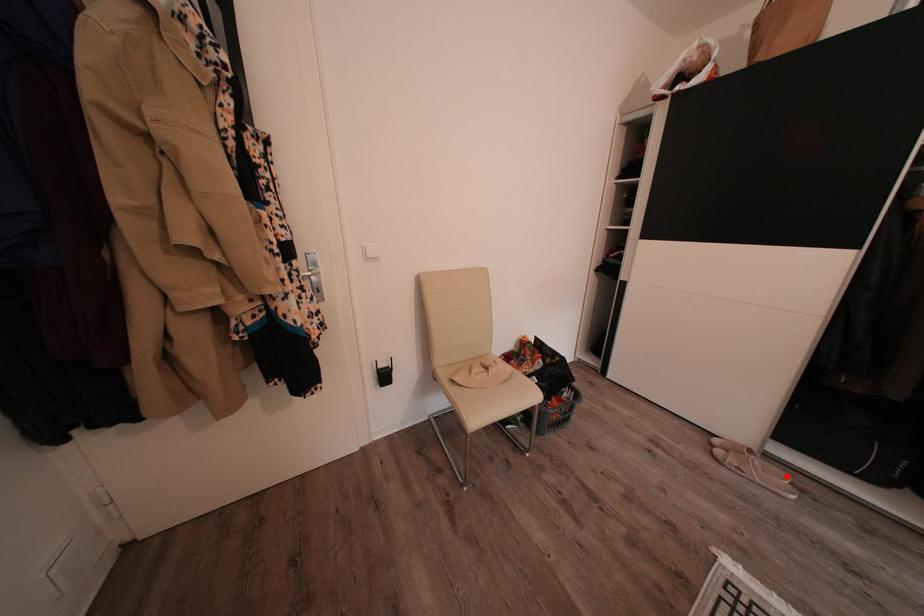
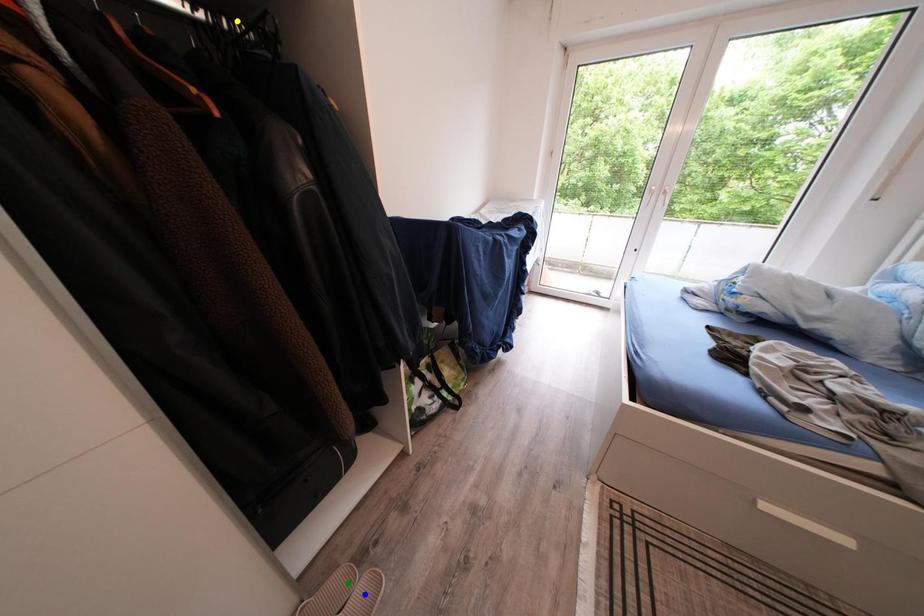
Question: I am providing you with two images of the same scene from different viewpoints. A red point is marked on the first image. You are given multiple points on the second image. Can you choose the point in image 2 that corresponds to the point in image 1?

Choices:
 (A) green point
 (B) blue point
 (C) yellow point

Answer: (A)